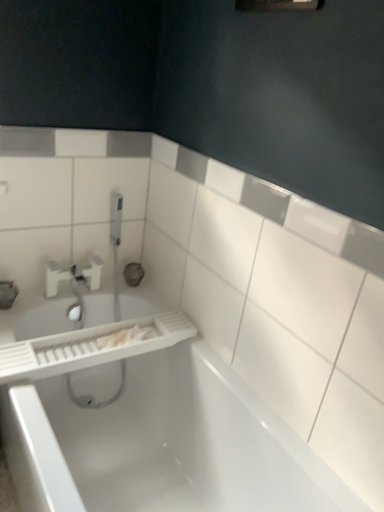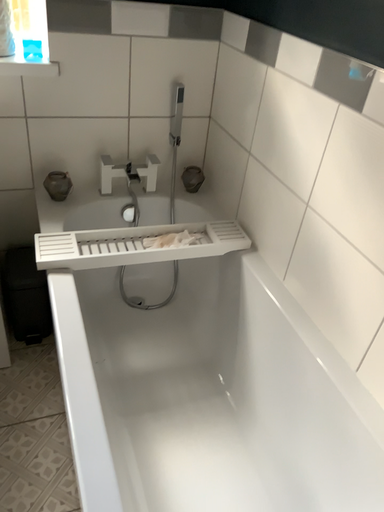
Question: How did the camera likely rotate when shooting the video?

Choices:
 (A) rotated upward
 (B) rotated downward

Answer: (B)